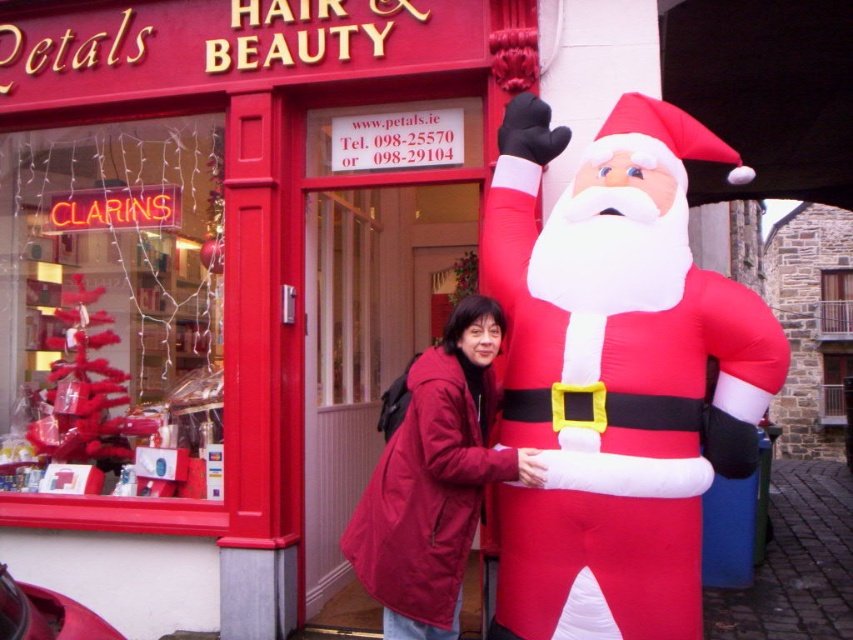
You are a delivery person trying to park your van in front of the matte red store at center. There is a matte red coat at center blocking the entrance. Can you drive your van through the space between the two objects?

The matte red store at center is positioned over matte red coat at center, meaning they are stacked vertically. Since they are not side by side, there is no space between them for the van to pass through.

You are standing in front of the shop and want to take a photo of both the matte red store at center and the inflatable red santa claus at right. Based on their positions, which object should you position to your left side when framing the shot?

The matte red store at center is to the left of the inflatable red santa claus at right, so when framing the shot, you should position the matte red store at center to your left side and the inflatable red santa claus at right to your right side.

You are a delivery person who needs to place a new box in front of the shop. The box is 1.2 meters wide. There is an inflatable red santa claus at right and a matte red coat at center. Which object should you move to make space for the box?

The inflatable red santa claus at right has a larger size compared to the matte red coat at center, so you should move the matte red coat at center to make space for the box since it is smaller and easier to move.